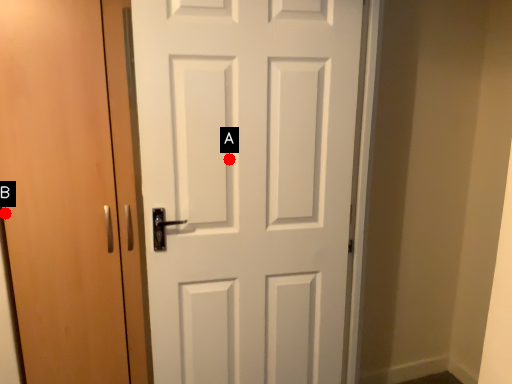
Question: Two points are circled on the image, labeled by A and B beside each circle. Which of the following is the farthest from the observer?

Choices:
 (A) A is further
 (B) B is further

Answer: (B)